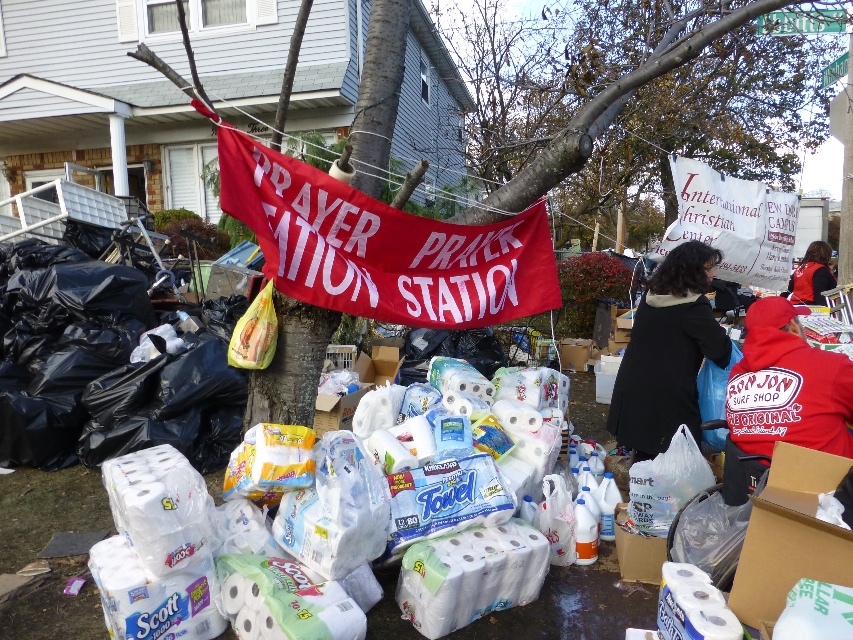
Can you confirm if black plastic bags at left is positioned to the right of black coat at center?

No, black plastic bags at left is not to the right of black coat at center.

Can you confirm if black plastic bags at left is thinner than black coat at center?

Incorrect, black plastic bags at left's width is not less than black coat at center's.

Does point (99, 376) lie behind point (637, 364)?

Yes.

Find the location of a particular element. black plastic bags at left is located at coordinates (113, 371).

Does point (77, 449) come closer to viewer compared to point (660, 609)?

No, it is not.

Can you confirm if black plastic bags at left is bigger than white matte scott toilet paper at lower center?

Yes.

Identify the location of black plastic bags at left. (113, 371).

The width and height of the screenshot is (853, 640). What are the coordinates of `black plastic bags at left` in the screenshot? It's located at pos(113,371).

Does black plastic bags at left have a lesser height compared to white matte toilet paper at center?

No.

Is point (213, 420) in front of point (358, 536)?

No, (213, 420) is further to viewer.

At what (x,y) coordinates should I click in order to perform the action: click on black plastic bags at left. Please return your answer as a coordinate pair (x, y). Looking at the image, I should click on (113, 371).